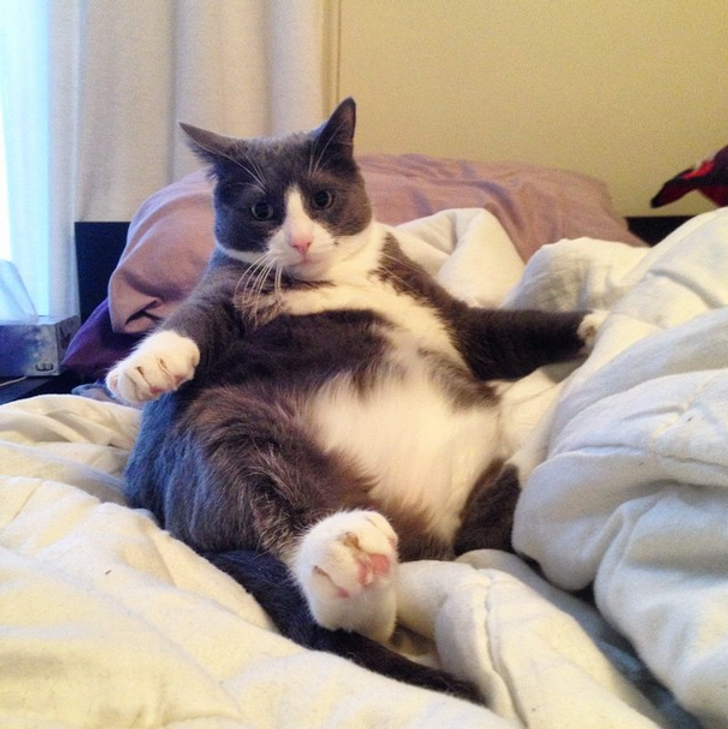
The width and height of the screenshot is (728, 729). Find the location of `pillow`. pillow is located at coordinates (514, 195).